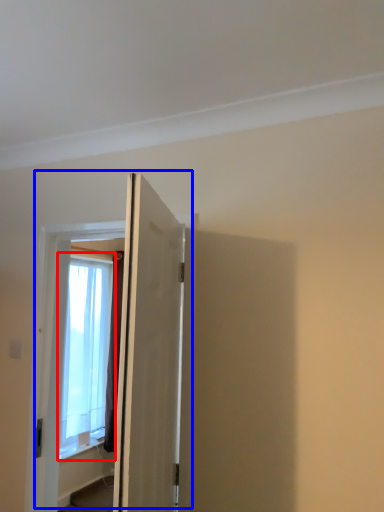
Question: Which point is closer to the camera, window (highlighted by a red box) or door (highlighted by a blue box)?

Choices:
 (A) window
 (B) door

Answer: (B)